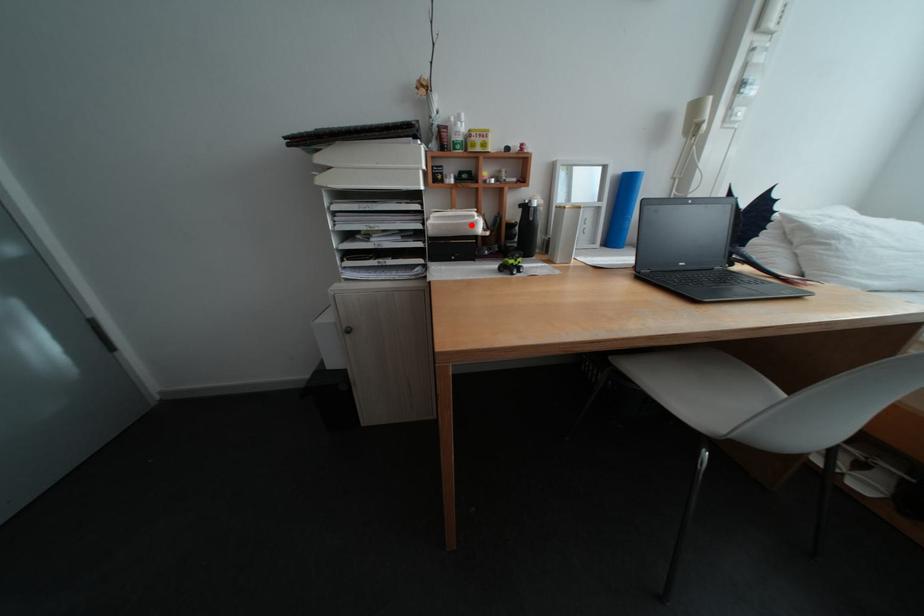
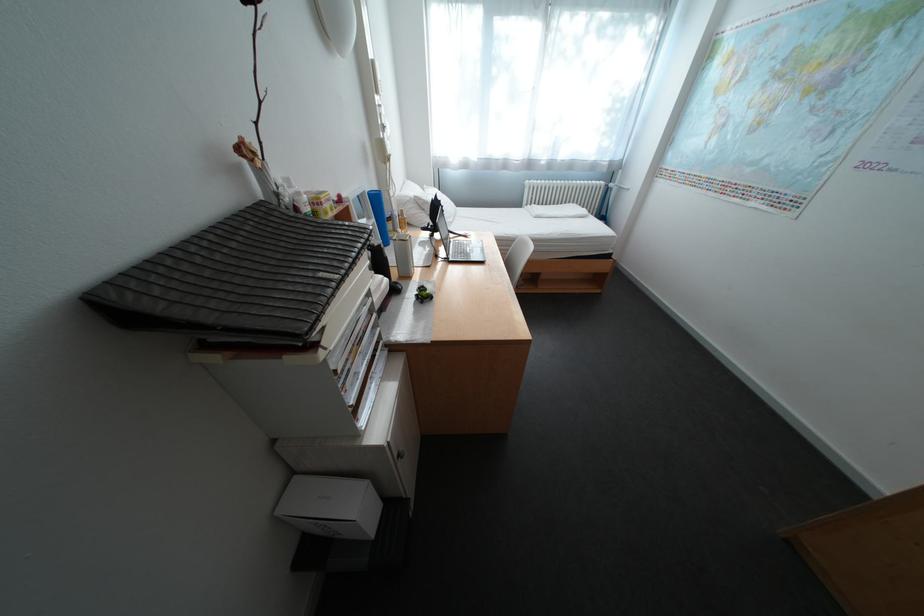
The point at the highlighted location is marked in the first image. Where is the corresponding point in the second image?

(395, 292)